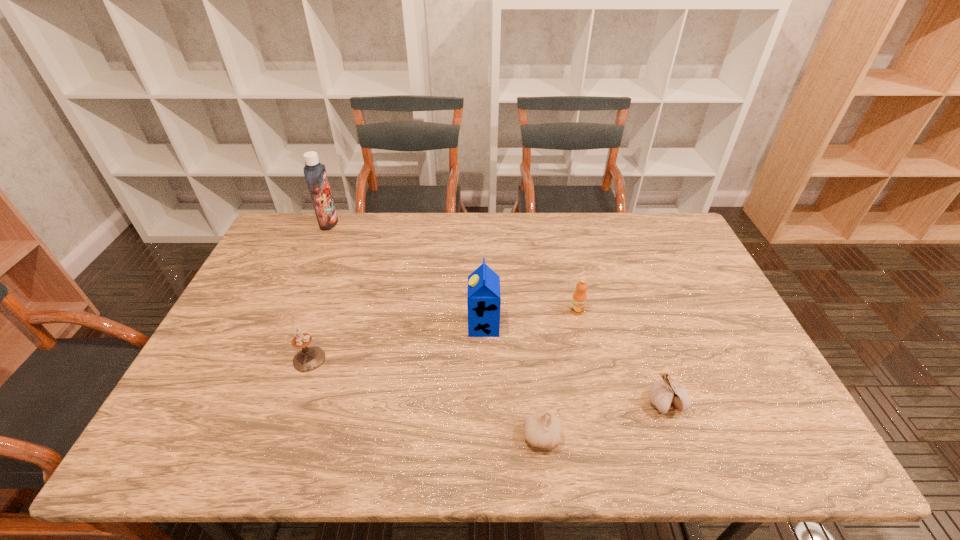
Where is `object at the near edge`? object at the near edge is located at coordinates (542, 429).

The image size is (960, 540). What are the coordinates of `object at the left edge` in the screenshot? It's located at (315, 173).

Identify the location of object present at the far left corner. (315, 173).

What are the coordinates of `vacant position at the far edge of the desktop` in the screenshot? It's located at 488,237.

Locate an element on the screen. The height and width of the screenshot is (540, 960). free point at the near edge is located at coordinates (445, 456).

Find the location of `vacant region at the far right corner of the desktop`. vacant region at the far right corner of the desktop is located at coordinates (664, 217).

Locate an element on the screen. This screenshot has width=960, height=540. vacant area between the carton and the shampoo is located at coordinates (406, 274).

Identify the location of free space between the tallest object and the second tallest object. (406, 274).

Identify the location of vacant point located between the left garlic and the orange juice. The height and width of the screenshot is (540, 960). (560, 373).

The width and height of the screenshot is (960, 540). Find the location of `vacant area that lies between the third nearest object and the shorter garlic`. vacant area that lies between the third nearest object and the shorter garlic is located at coordinates (425, 397).